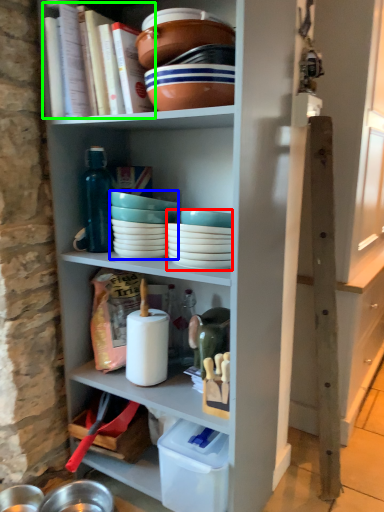
Question: Which object is positioned closest to tableware (highlighted by a red box)? Select from tableware (highlighted by a blue box) and book (highlighted by a green box).

Choices:
 (A) tableware
 (B) book

Answer: (A)